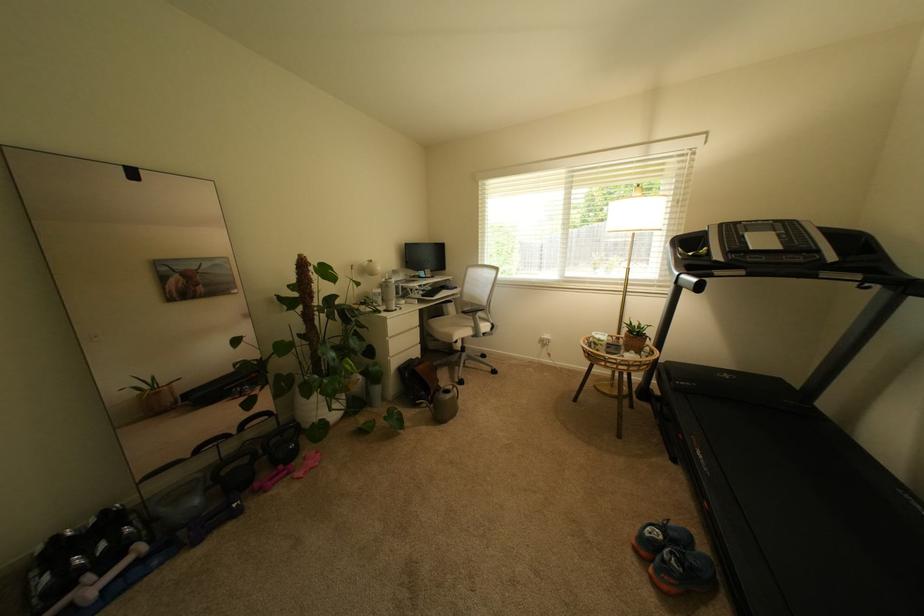
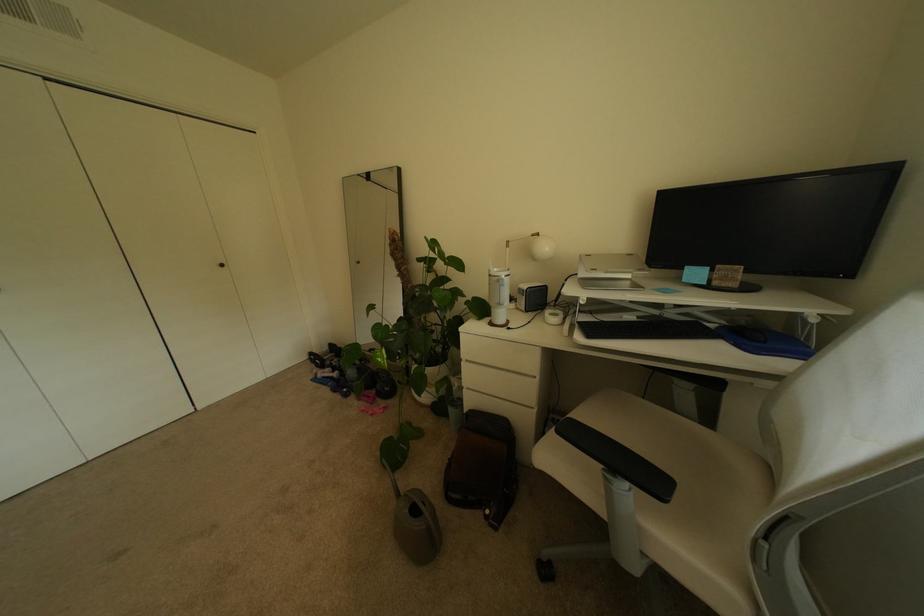
Locate, in the second image, the point that corresponds to [144,562] in the first image.

(341, 379)